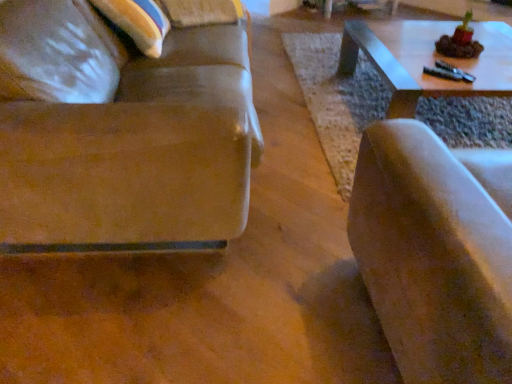
Question: From the image's perspective, is suede-like beige chair at right positioned above or below suede-like brown couch at left?

Choices:
 (A) above
 (B) below

Answer: (B)

Question: In the image, is suede-like beige chair at right on the left side or the right side of suede-like brown couch at left?

Choices:
 (A) right
 (B) left

Answer: (A)

Question: Is suede-like beige chair at right bigger or smaller than suede-like brown couch at left?

Choices:
 (A) small
 (B) big

Answer: (A)

Question: Is suede-like brown couch at left taller or shorter than suede-like beige chair at right?

Choices:
 (A) tall
 (B) short

Answer: (A)

Question: From the image's perspective, is suede-like brown couch at left located above or below suede-like beige chair at right?

Choices:
 (A) above
 (B) below

Answer: (A)

Question: Is suede-like brown couch at left bigger or smaller than suede-like beige chair at right?

Choices:
 (A) small
 (B) big

Answer: (B)

Question: Would you say suede-like brown couch at left is to the left or to the right of suede-like beige chair at right in the picture?

Choices:
 (A) left
 (B) right

Answer: (A)